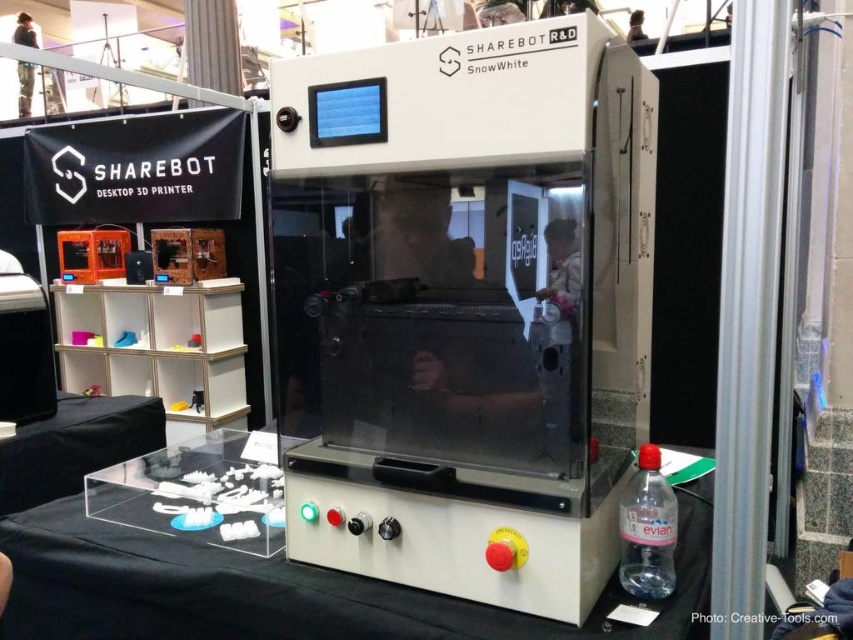
Question: Can you confirm if white plastic 3d printer at center is positioned above white plastic table at center?

Choices:
 (A) no
 (B) yes

Answer: (B)

Question: Is white plastic 3d printer at center positioned before white plastic table at center?

Choices:
 (A) no
 (B) yes

Answer: (B)

Question: Is white plastic 3d printer at center behind white plastic table at center?

Choices:
 (A) no
 (B) yes

Answer: (A)

Question: Among these objects, which one is farthest from the camera?

Choices:
 (A) white plastic 3d printer at center
 (B) white plastic table at center

Answer: (B)

Question: Which point is closer to the camera?

Choices:
 (A) white plastic 3d printer at center
 (B) white plastic table at center

Answer: (A)